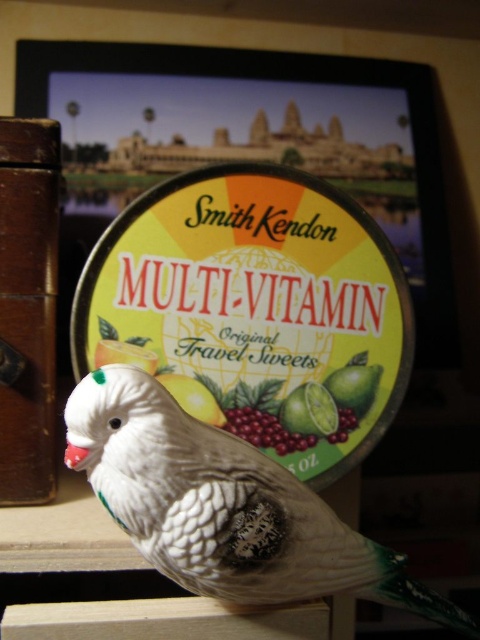
Question: Can you confirm if white matte bird at lower left is positioned below yellow matte lemon at center?

Choices:
 (A) no
 (B) yes

Answer: (B)

Question: Does green matte lime at center have a smaller size compared to lemon matte/glossy at center?

Choices:
 (A) no
 (B) yes

Answer: (B)

Question: Which of these objects is positioned closest to the white matte bird at lower left?

Choices:
 (A) lemon matte/glossy at center
 (B) yellow matte lemon at center

Answer: (B)

Question: Which object is closer to the camera taking this photo?

Choices:
 (A) white matte bird at lower left
 (B) lemon matte/glossy at center
 (C) green matte lime at center

Answer: (A)

Question: Estimate the real-world distances between objects in this image. Which object is closer to the white matte bird at lower left?

Choices:
 (A) yellow matte lemon at center
 (B) green matte lime at center

Answer: (A)

Question: In this image, where is white matte bird at lower left located relative to yellow matte lemon at center?

Choices:
 (A) above
 (B) below

Answer: (B)